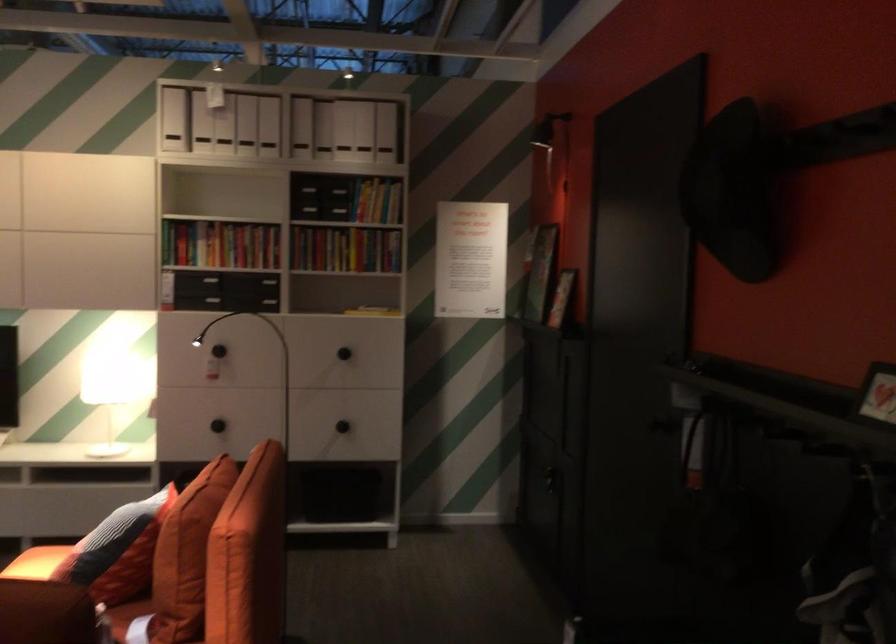
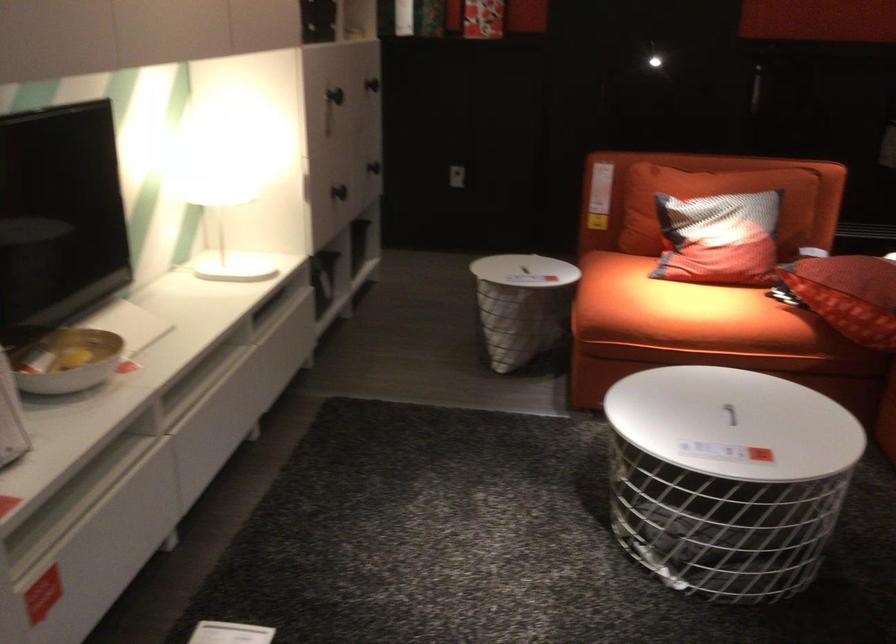
Where in the second image is the point corresponding to point 207,424 from the first image?

(339, 192)